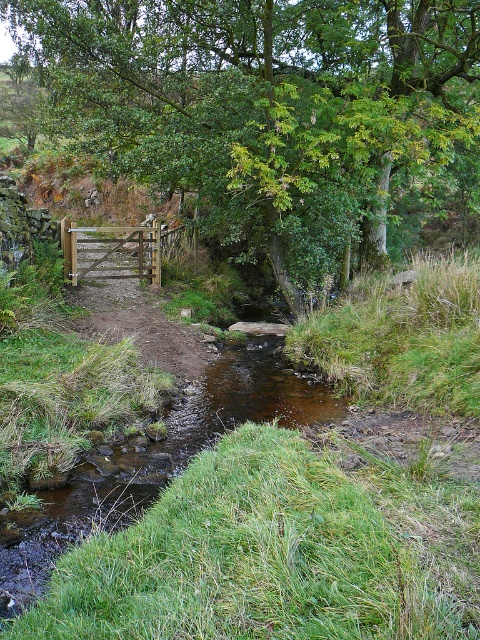
Question: Can you confirm if green leafy tree at upper center is positioned to the right of brown wooden gate at center?

Choices:
 (A) no
 (B) yes

Answer: (B)

Question: Among these points, which one is nearest to the camera?

Choices:
 (A) (81, 272)
 (B) (388, 170)

Answer: (B)

Question: Can you confirm if green leafy tree at upper center is wider than brown wooden gate at center?

Choices:
 (A) yes
 (B) no

Answer: (A)

Question: Is green leafy tree at upper center further to the viewer compared to brown wooden gate at center?

Choices:
 (A) yes
 (B) no

Answer: (B)